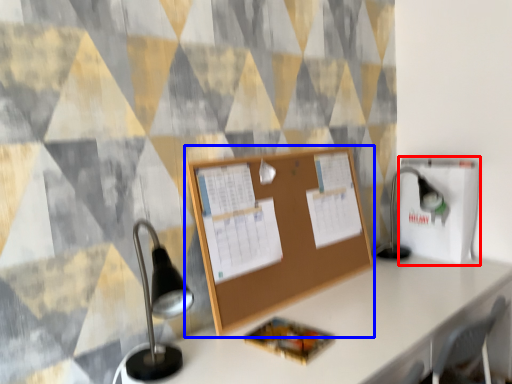
Question: Which object appears closest to the camera in this image, cardboard box (highlighted by a red box) or bulletin board (highlighted by a blue box)?

Choices:
 (A) cardboard box
 (B) bulletin board

Answer: (B)